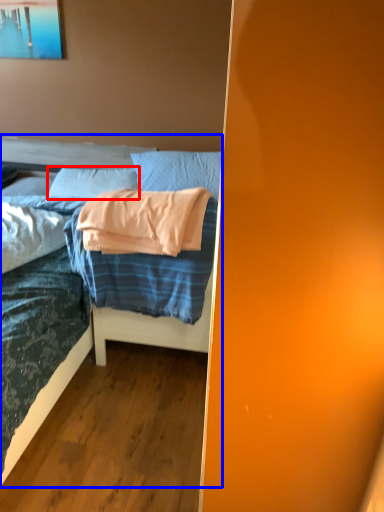
Question: Which of the following is the closest to the observer, pillow (highlighted by a red box) or bed (highlighted by a blue box)?

Choices:
 (A) pillow
 (B) bed

Answer: (B)